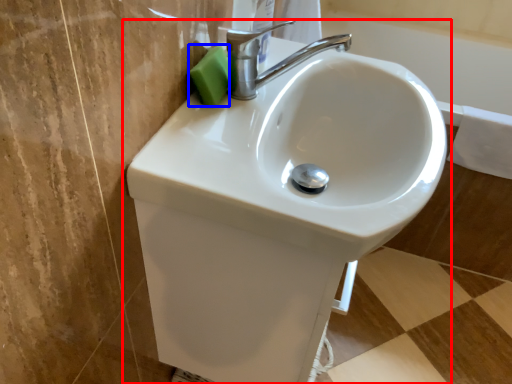
Question: Which of the following is the closest to the observer, sink (highlighted by a red box) or soap (highlighted by a blue box)?

Choices:
 (A) sink
 (B) soap

Answer: (A)